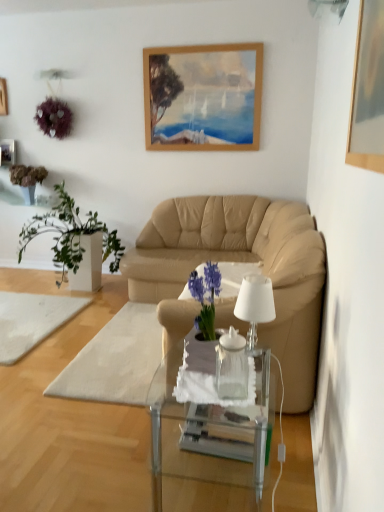
Question: From the image's perspective, is white fabric footrest at center on top of green leafy plant at left, which appears as the 1th houseplant when viewed from the right?

Choices:
 (A) yes
 (B) no

Answer: (B)

Question: Can we say white fabric footrest at center lies outside green leafy plant at left, which appears as the second houseplant when viewed from the left?

Choices:
 (A) no
 (B) yes

Answer: (B)

Question: Does white fabric footrest at center have a greater width compared to green leafy plant at left, which appears as the second houseplant when viewed from the left?

Choices:
 (A) yes
 (B) no

Answer: (B)

Question: From the image's perspective, does white fabric footrest at center appear lower than green leafy plant at left, which appears as the 1th houseplant when viewed from the right?

Choices:
 (A) no
 (B) yes

Answer: (B)

Question: Is the depth of white fabric footrest at center greater than that of green leafy plant at left, which appears as the second houseplant when viewed from the left?

Choices:
 (A) no
 (B) yes

Answer: (A)

Question: From a real-world perspective, is wooden picture frame at upper left, the 2th picture frame viewed from the front, positioned above or below green leafy plant at left, which appears as the second houseplant when viewed from the left?

Choices:
 (A) above
 (B) below

Answer: (A)

Question: In terms of size, does wooden picture frame at upper left, acting as the third picture frame starting from the right, appear bigger or smaller than green leafy plant at left, which appears as the second houseplant when viewed from the left?

Choices:
 (A) small
 (B) big

Answer: (A)

Question: From the image's perspective, is wooden picture frame at upper left, the 2th picture frame viewed from the front, located above or below green leafy plant at left, which appears as the second houseplant when viewed from the left?

Choices:
 (A) above
 (B) below

Answer: (A)

Question: In the image, is wooden picture frame at upper left, arranged as the 1th picture frame when viewed from the left, on the left side or the right side of green leafy plant at left, which appears as the second houseplant when viewed from the left?

Choices:
 (A) left
 (B) right

Answer: (A)

Question: Is green leafy plant at upper left, positioned as the 1th houseplant in left-to-right order, spatially inside white glass lamp at center, or outside of it?

Choices:
 (A) outside
 (B) inside

Answer: (A)

Question: Is green leafy plant at upper left, positioned as the 1th houseplant in left-to-right order, bigger or smaller than white glass lamp at center?

Choices:
 (A) small
 (B) big

Answer: (B)

Question: Does point (29, 189) appear closer or farther from the camera than point (268, 317)?

Choices:
 (A) closer
 (B) farther

Answer: (B)

Question: Considering the positions of green leafy plant at upper left, marked as the second houseplant in a right-to-left arrangement, and white glass lamp at center in the image, is green leafy plant at upper left, marked as the second houseplant in a right-to-left arrangement, taller or shorter than white glass lamp at center?

Choices:
 (A) tall
 (B) short

Answer: (A)

Question: From a real-world perspective, relative to wooden picture frame at upper left, the 1th picture frame when ordered from top to bottom, is white fabric footrest at center vertically above or below?

Choices:
 (A) above
 (B) below

Answer: (B)

Question: Is white fabric footrest at center situated inside wooden picture frame at upper left, the 2th picture frame viewed from the front, or outside?

Choices:
 (A) inside
 (B) outside

Answer: (B)